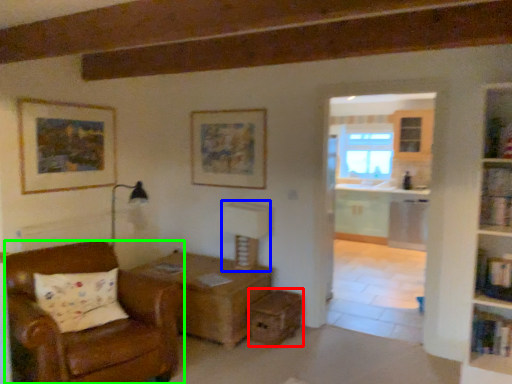
Question: Which object is the farthest from drawer (highlighted by a red box)? Choose among these: table lamp (highlighted by a blue box) or chair (highlighted by a green box).

Choices:
 (A) table lamp
 (B) chair

Answer: (B)